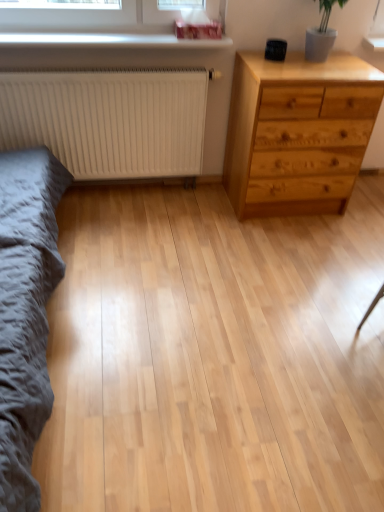
Question: From a real-world perspective, does white matte radiator at left sit lower than white glossy window sill at upper center?

Choices:
 (A) yes
 (B) no

Answer: (A)

Question: Are white matte radiator at left and white glossy window sill at upper center located far from each other?

Choices:
 (A) yes
 (B) no

Answer: (B)

Question: Is white matte radiator at left thinner than white glossy window sill at upper center?

Choices:
 (A) yes
 (B) no

Answer: (A)

Question: From the image's perspective, is white matte radiator at left on white glossy window sill at upper center?

Choices:
 (A) no
 (B) yes

Answer: (A)

Question: Would you say white glossy window sill at upper center is part of white matte radiator at left's contents?

Choices:
 (A) yes
 (B) no

Answer: (B)

Question: From a real-world perspective, is white matte radiator at left over white glossy window sill at upper center?

Choices:
 (A) no
 (B) yes

Answer: (A)

Question: Is dark gray fabric bed frame at left taller than natural wood chest of drawers at right?

Choices:
 (A) yes
 (B) no

Answer: (A)

Question: From the image's perspective, does dark gray fabric bed frame at left appear lower than natural wood chest of drawers at right?

Choices:
 (A) yes
 (B) no

Answer: (A)

Question: Does dark gray fabric bed frame at left have a lesser width compared to natural wood chest of drawers at right?

Choices:
 (A) no
 (B) yes

Answer: (B)

Question: From a real-world perspective, does dark gray fabric bed frame at left sit lower than natural wood chest of drawers at right?

Choices:
 (A) no
 (B) yes

Answer: (A)

Question: From the image's perspective, does dark gray fabric bed frame at left appear higher than natural wood chest of drawers at right?

Choices:
 (A) no
 (B) yes

Answer: (A)

Question: Considering the relative sizes of dark gray fabric bed frame at left and natural wood chest of drawers at right in the image provided, is dark gray fabric bed frame at left smaller than natural wood chest of drawers at right?

Choices:
 (A) no
 (B) yes

Answer: (A)

Question: From the image's perspective, is white matte radiator at left below dark gray fabric bed frame at left?

Choices:
 (A) no
 (B) yes

Answer: (A)